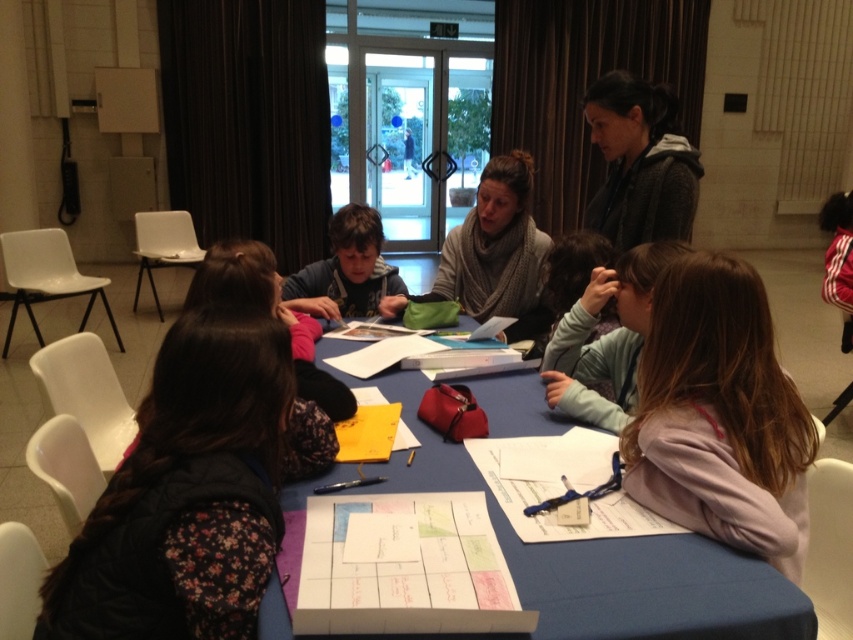
Is the position of pink fleece jacket at center less distant than that of blue fabric table at center?

That is True.

Does pink fleece jacket at center have a greater height compared to blue fabric table at center?

Yes, pink fleece jacket at center is taller than blue fabric table at center.

Describe the element at coordinates (718, 416) in the screenshot. I see `pink fleece jacket at center` at that location.

The height and width of the screenshot is (640, 853). I want to click on pink fleece jacket at center, so click(x=718, y=416).

Who is taller, knitted scarf at center or pink fleece jacket at lower right?

With more height is knitted scarf at center.

Can you confirm if knitted scarf at center is positioned to the right of pink fleece jacket at lower right?

No, knitted scarf at center is not to the right of pink fleece jacket at lower right.

Is point (514, 234) positioned after point (625, 323)?

Yes, point (514, 234) is farther from viewer.

At what (x,y) coordinates should I click in order to perform the action: click on knitted scarf at center. Please return your answer as a coordinate pair (x, y). The height and width of the screenshot is (640, 853). Looking at the image, I should click on (497, 252).

Which is in front, point (766, 420) or point (476, 216)?

Point (766, 420) is in front.

Who is taller, pink fleece jacket at center or knitted scarf at center?

knitted scarf at center is taller.

The width and height of the screenshot is (853, 640). What do you see at coordinates (718, 416) in the screenshot? I see `pink fleece jacket at center` at bounding box center [718, 416].

This screenshot has width=853, height=640. What are the coordinates of `pink fleece jacket at center` in the screenshot? It's located at (718, 416).